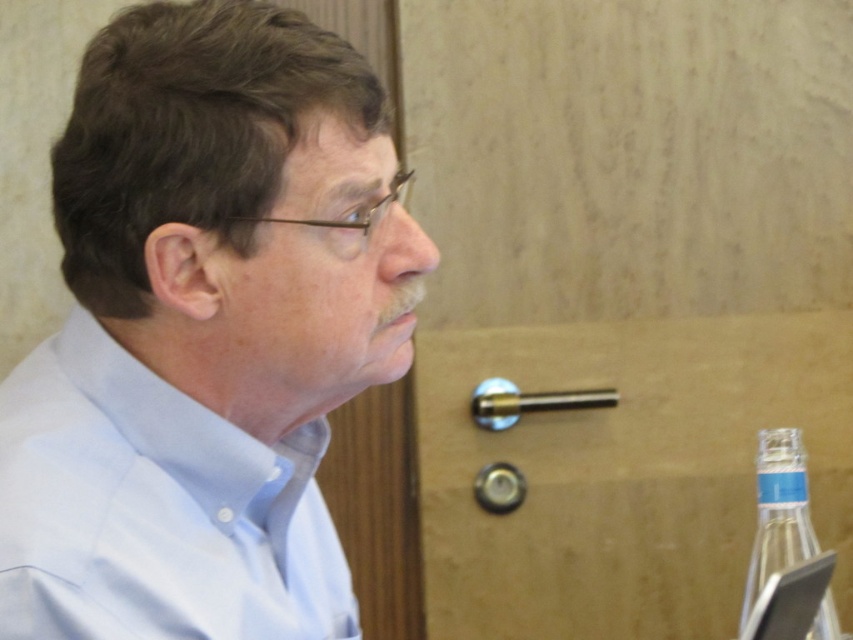
Is light blue cotton shirt at left thinner than clear glass bottle at lower right?

Incorrect, light blue cotton shirt at left's width is not less than clear glass bottle at lower right's.

Can you confirm if light blue cotton shirt at left is positioned to the right of clear glass bottle at lower right?

No, light blue cotton shirt at left is not to the right of clear glass bottle at lower right.

Which is in front, point (173, 614) or point (817, 545)?

Point (173, 614)

This screenshot has width=853, height=640. I want to click on light blue cotton shirt at left, so click(154, 509).

Between light blue shirt at center and light blue cotton shirt at left, which one appears on the left side from the viewer's perspective?

light blue cotton shirt at left

Measure the distance between light blue shirt at center and camera.

A distance of 25.88 inches exists between light blue shirt at center and camera.

Which is in front, point (320, 182) or point (131, 374)?

Point (320, 182) is more forward.

At what (x,y) coordinates should I click in order to perform the action: click on light blue shirt at center. Please return your answer as a coordinate pair (x, y). Looking at the image, I should click on (218, 296).

Is light blue shirt at center smaller than clear glass bottle at lower right?

Actually, light blue shirt at center might be larger than clear glass bottle at lower right.

Consider the image. Is light blue shirt at center to the left of clear glass bottle at lower right from the viewer's perspective?

Yes, light blue shirt at center is to the left of clear glass bottle at lower right.

Where is `light blue shirt at center`? The height and width of the screenshot is (640, 853). light blue shirt at center is located at coordinates (218, 296).

Identify the location of light blue shirt at center. (218, 296).